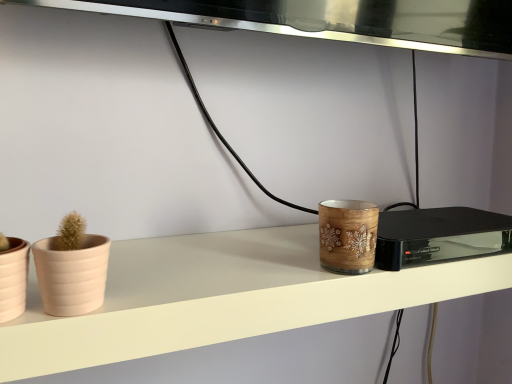
Image resolution: width=512 pixels, height=384 pixels. In order to click on vacant area on top of wooden candle holder at center (from a real-world perspective) in this screenshot , I will do `click(434, 223)`.